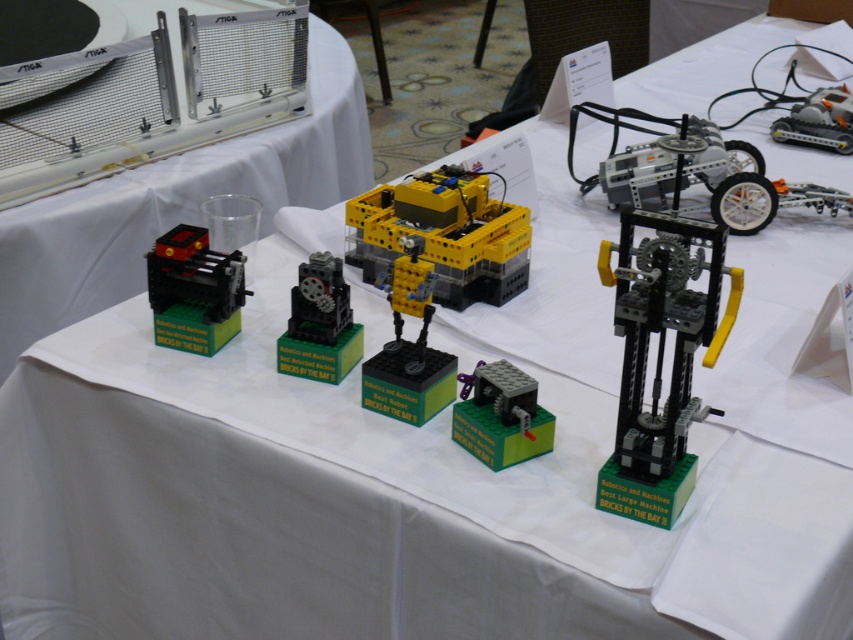
Question: Can you confirm if matte black machine at left is positioned below metallic silver airplane at upper right?

Choices:
 (A) no
 (B) yes

Answer: (B)

Question: Which point is closer to the camera?

Choices:
 (A) (451, 285)
 (B) (303, 298)
 (C) (811, 131)

Answer: (B)

Question: Among these points, which one is farthest from the camera?

Choices:
 (A) (178, 266)
 (B) (849, 113)
 (C) (463, 179)

Answer: (B)

Question: Estimate the real-world distances between objects in this image. Which object is closer to the metallic silver airplane at upper right?

Choices:
 (A) translucent plastic tower at center
 (B) matte black gear at center
 (C) matte black machine at left
 (D) yellow plastic robot at center

Answer: (D)

Question: Is matte black gear at center to the right of translucent plastic gear at center from the viewer's perspective?

Choices:
 (A) no
 (B) yes

Answer: (B)

Question: Is translucent plastic tower at center bigger than matte black gear at center?

Choices:
 (A) yes
 (B) no

Answer: (A)